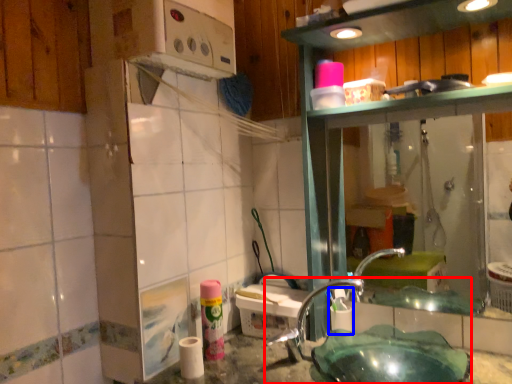
Question: Which object is further to the camera taking this photo, sink (highlighted by a red box) or shaving cream (highlighted by a blue box)?

Choices:
 (A) sink
 (B) shaving cream

Answer: (B)